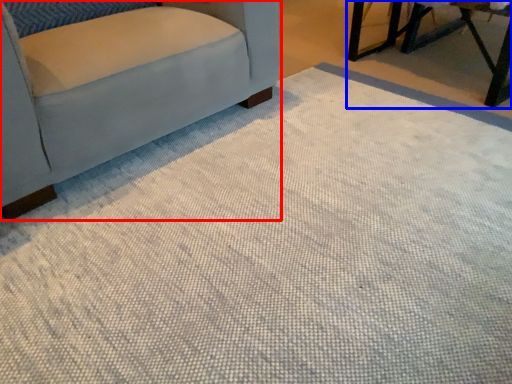
Question: Among these objects, which one is nearest to the camera, chair (highlighted by a red box) or table (highlighted by a blue box)?

Choices:
 (A) chair
 (B) table

Answer: (A)